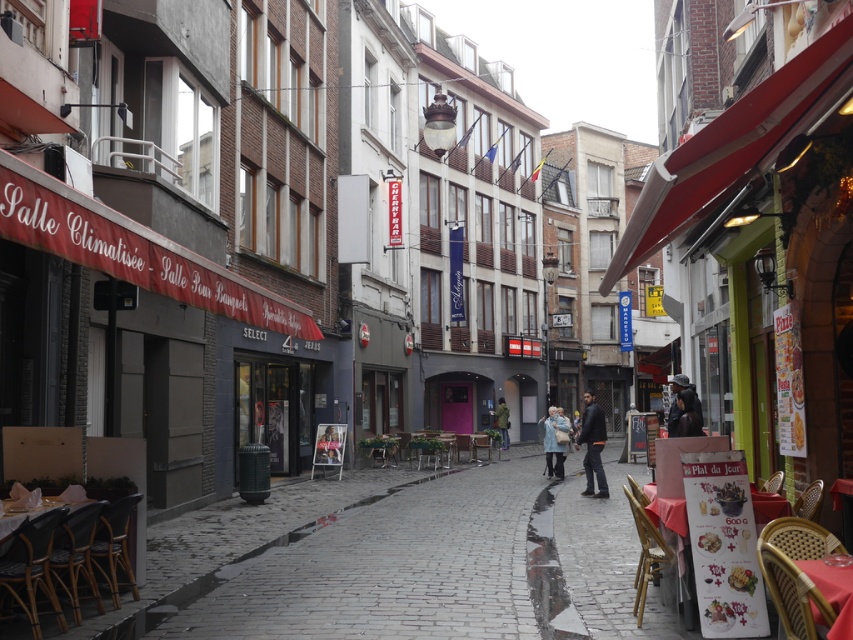
Which is above, dark brown leather jacket at center or light blue denim jacket at center?

dark brown leather jacket at center is higher up.

Who is more distant from viewer, (683, 435) or (560, 449)?

The point (560, 449) is behind.

Find the location of a particular element. dark brown leather jacket at center is located at coordinates (688, 413).

Is dark brown leather jacket at center thinner than green fabric jacket at center?

No, dark brown leather jacket at center is not thinner than green fabric jacket at center.

Which is below, dark brown leather jacket at center or green fabric jacket at center?

green fabric jacket at center is below.

Locate an element on the screen. This screenshot has height=640, width=853. dark brown leather jacket at center is located at coordinates click(x=688, y=413).

Does light blue denim jacket at center have a greater height compared to green fabric jacket at center?

Incorrect, light blue denim jacket at center's height is not larger of green fabric jacket at center's.

Between light blue denim jacket at center and green fabric jacket at center, which one appears on the left side from the viewer's perspective?

Positioned to the left is green fabric jacket at center.

Is point (555, 452) closer to viewer compared to point (506, 417)?

Yes, point (555, 452) is in front of point (506, 417).

Identify the location of light blue denim jacket at center. (560, 438).